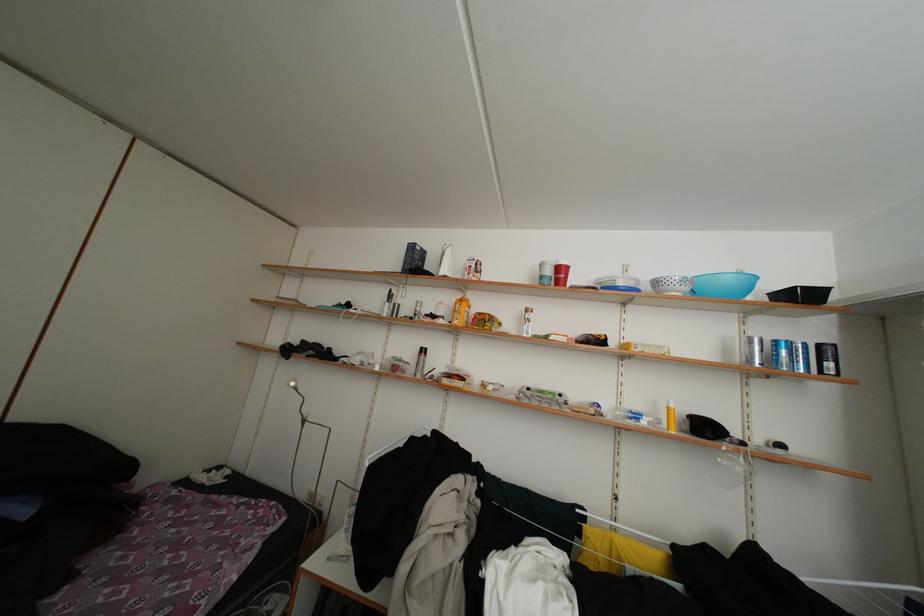
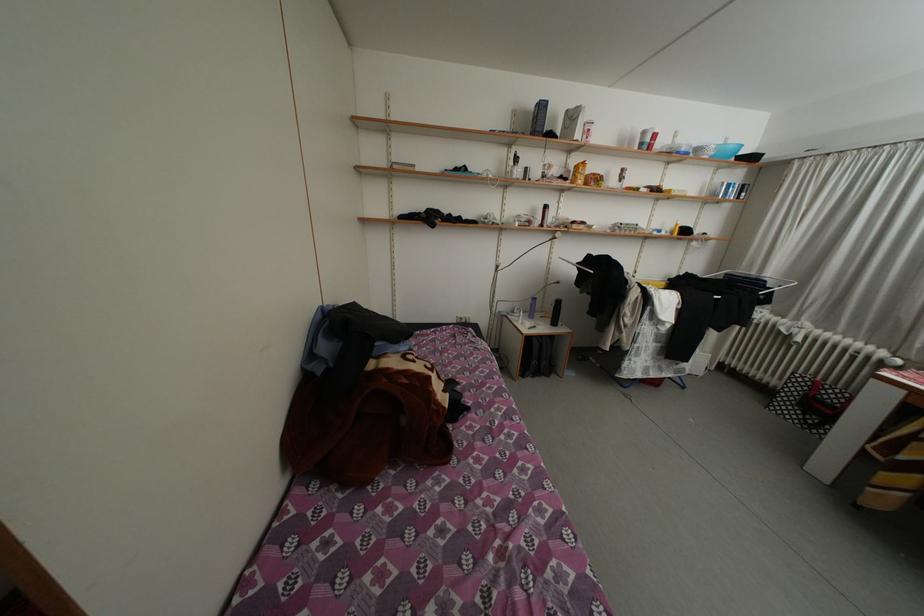
Find the pixel in the second image that matches point 550,283 in the first image.

(650, 148)